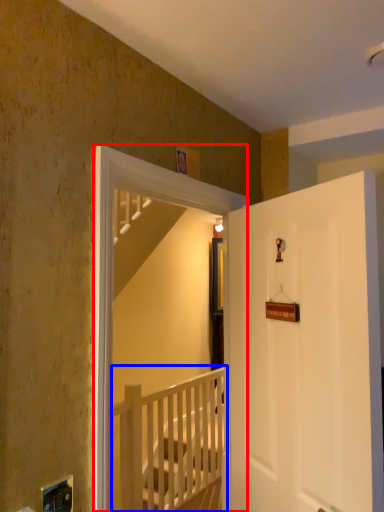
Question: Which point is further to the camera, screen door (highlighted by a red box) or rail (highlighted by a blue box)?

Choices:
 (A) screen door
 (B) rail

Answer: (B)